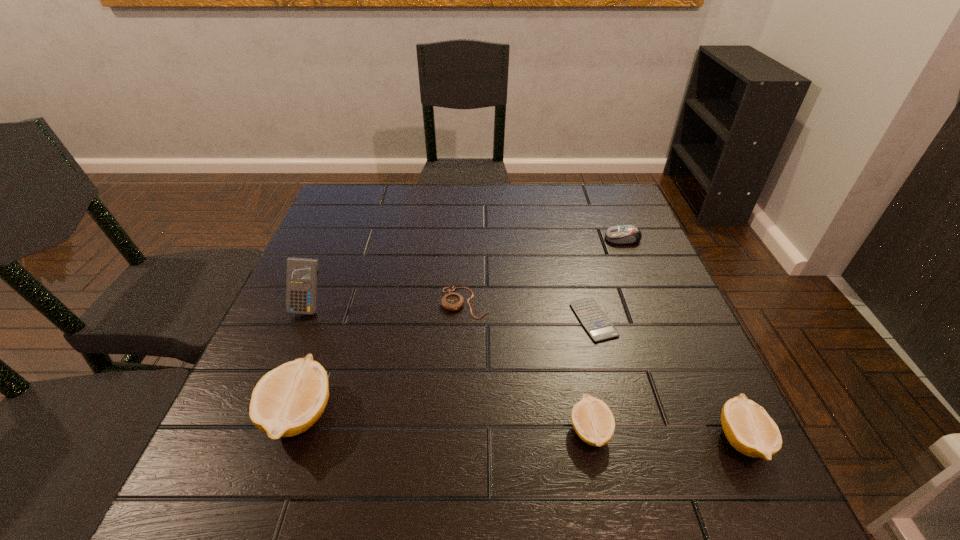
Where is `the tallest lemon`? This screenshot has height=540, width=960. the tallest lemon is located at coordinates (288, 400).

Locate an element on the screen. the leftmost lemon is located at coordinates (288, 400).

Where is `the second lemon from left to right`? This screenshot has height=540, width=960. the second lemon from left to right is located at coordinates (593, 421).

Find the location of a particular element. The image size is (960, 540). the fifth shortest object is located at coordinates (748, 427).

Where is `the second shortest lemon`? the second shortest lemon is located at coordinates (748, 427).

Locate an element on the screen. Image resolution: width=960 pixels, height=540 pixels. the taller calculator is located at coordinates (301, 279).

What are the coordinates of `the left calculator` in the screenshot? It's located at (x=301, y=279).

Find the location of a particular element. This screenshot has width=960, height=540. computer mouse is located at coordinates (624, 234).

This screenshot has width=960, height=540. In order to click on the fifth tallest object in this screenshot , I will do `click(624, 234)`.

Locate an element on the screen. pocket watch is located at coordinates (452, 301).